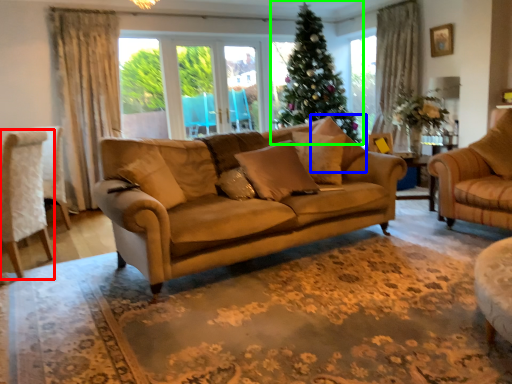
Question: Estimate the real-world distances between objects in this image. Which object is closer to chair (highlighted by a red box), pillow (highlighted by a blue box) or christmas tree (highlighted by a green box)?

Choices:
 (A) pillow
 (B) christmas tree

Answer: (A)